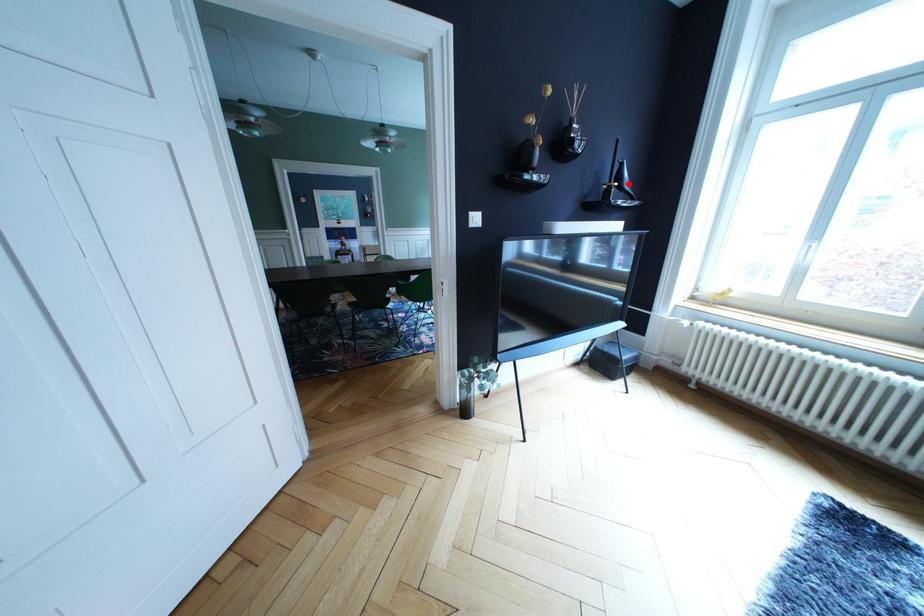
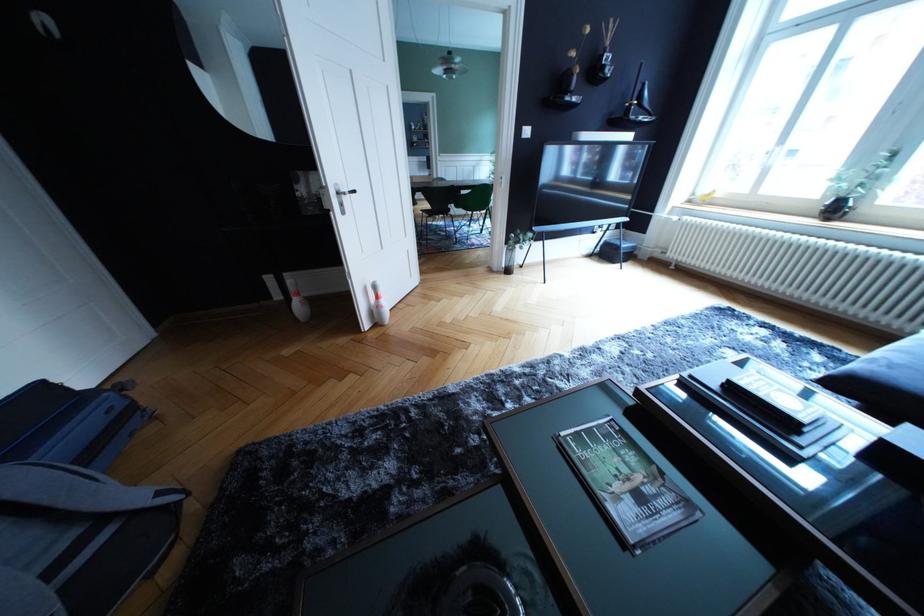
In the second image, find the point that corresponds to the highlighted location in the first image.

(648, 103)